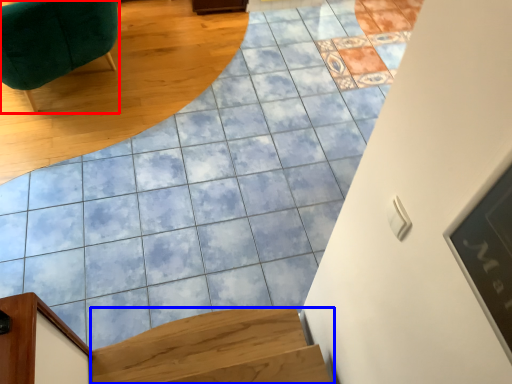
Question: Which of the following is the farthest to the observer, furniture (highlighted by a red box) or stairs (highlighted by a blue box)?

Choices:
 (A) furniture
 (B) stairs

Answer: (A)